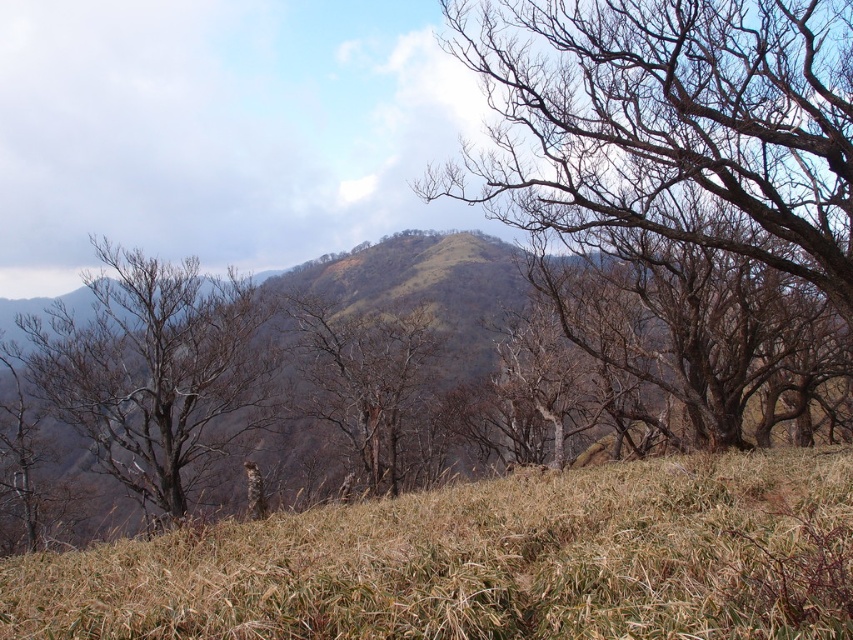
You are standing at a point in the landscape and see two points marked in the scene. The first point is at coordinate point (317, 548), and the second point is at coordinate point (421, 308). Which point is closer to you?

Point (317, 548) is in front of point (421, 308), so it is closer to you.